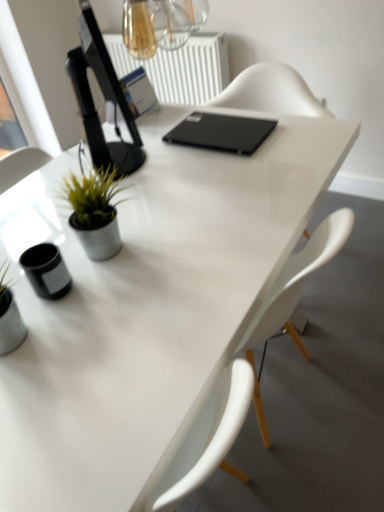
Question: From a real-world perspective, is black glossy computer monitor at upper left positioned above or below transparent glass window screen at upper left?

Choices:
 (A) below
 (B) above

Answer: (B)

Question: Considering their positions, is black glossy computer monitor at upper left located in front of or behind transparent glass window screen at upper left?

Choices:
 (A) behind
 (B) front

Answer: (B)

Question: Which object is the closest to the green matte plant at left?

Choices:
 (A) transparent glass window screen at upper left
 (B) black matte laptop at center
 (C) black glossy computer monitor at upper left
 (D) white plastic radiator at upper center

Answer: (C)

Question: Considering the real-world distances, which object is farthest from the black glossy computer monitor at upper left?

Choices:
 (A) green matte plant at left
 (B) black matte laptop at center
 (C) transparent glass window screen at upper left
 (D) white plastic radiator at upper center

Answer: (C)